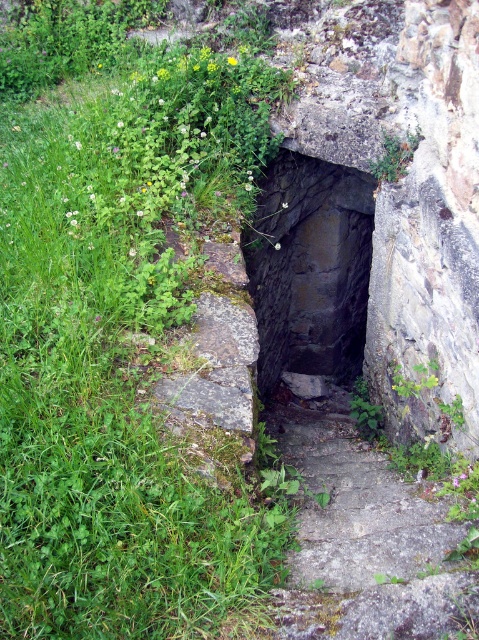
Is gray stone steps at center thinner than dark stone staircase at center?

Correct, gray stone steps at center's width is less than dark stone staircase at center's.

Can you confirm if gray stone steps at center is positioned above dark stone staircase at center?

No.

Between point (352, 490) and point (310, 273), which one is positioned in front?

Point (352, 490) is more forward.

At what (x,y) coordinates should I click in order to perform the action: click on gray stone steps at center. Please return your answer as a coordinate pair (x, y). The height and width of the screenshot is (640, 479). Looking at the image, I should click on (364, 541).

Is green leafy grass at left to the right of dark stone staircase at center from the viewer's perspective?

Incorrect, green leafy grass at left is not on the right side of dark stone staircase at center.

In the scene shown: Is green leafy grass at left bigger than dark stone staircase at center?

Yes, green leafy grass at left is bigger than dark stone staircase at center.

Where is `green leafy grass at left`? green leafy grass at left is located at coordinates (117, 346).

Identify the location of green leafy grass at left. This screenshot has width=479, height=640. (117, 346).

Does green leafy grass at left have a lesser height compared to gray stone steps at center?

No.

This screenshot has height=640, width=479. Describe the element at coordinates (117, 346) in the screenshot. I see `green leafy grass at left` at that location.

Identify the location of green leafy grass at left. (117, 346).